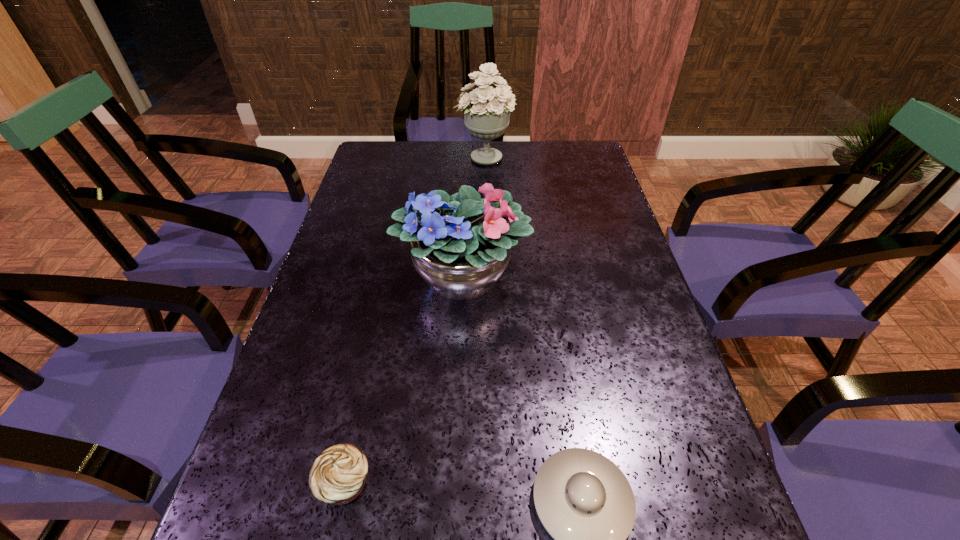
Select which object is the closest to the nearer bouquet. Please provide its 2D coordinates. Your answer should be formatted as a tuple, i.e. [(x, y)], where the tuple contains the x and y coordinates of a point satisfying the conditions above.

[(584, 501)]